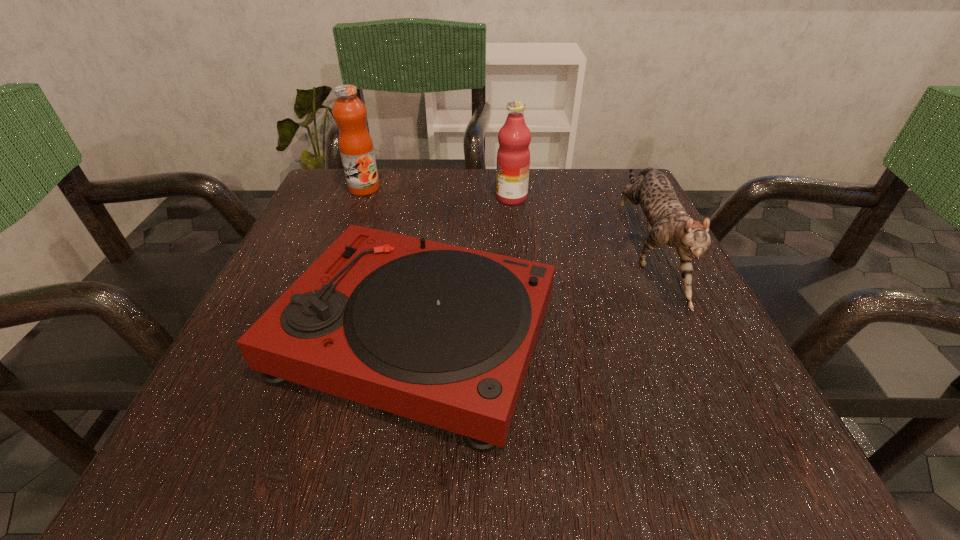
Find the location of a particular element. This screenshot has height=540, width=960. the left fruit juice is located at coordinates (356, 148).

At what (x,y) coordinates should I click in order to perform the action: click on the right fruit juice. Please return your answer as a coordinate pair (x, y). This screenshot has height=540, width=960. Looking at the image, I should click on (513, 156).

At what (x,y) coordinates should I click in order to perform the action: click on cat. Please return your answer as a coordinate pair (x, y). The image size is (960, 540). Looking at the image, I should click on (668, 223).

Identify the location of the second shortest object. The height and width of the screenshot is (540, 960). (668, 223).

I want to click on record player, so click(x=442, y=334).

Identify the location of free spot located on the front label of the left fruit juice. (335, 264).

Where is `free spot located 0.390m on the label of the right fruit juice`? The width and height of the screenshot is (960, 540). free spot located 0.390m on the label of the right fruit juice is located at coordinates (324, 198).

Identify the location of free space located on the label of the right fruit juice. This screenshot has width=960, height=540. (324, 198).

What are the coordinates of `free region located on the label of the right fruit juice` in the screenshot? It's located at (368, 198).

Locate an element on the screen. free location located on the face of the rightmost object is located at coordinates (712, 392).